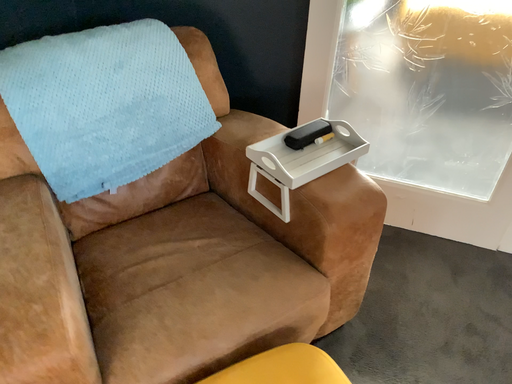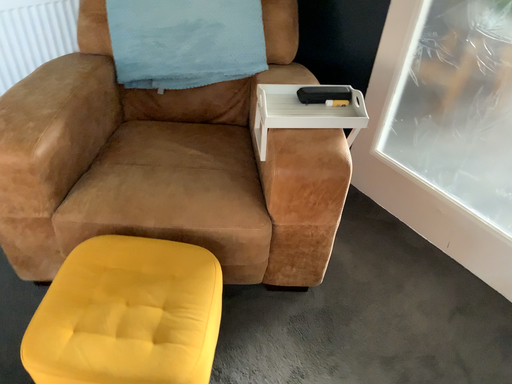
Question: How did the camera likely rotate when shooting the video?

Choices:
 (A) rotated left
 (B) rotated right

Answer: (A)